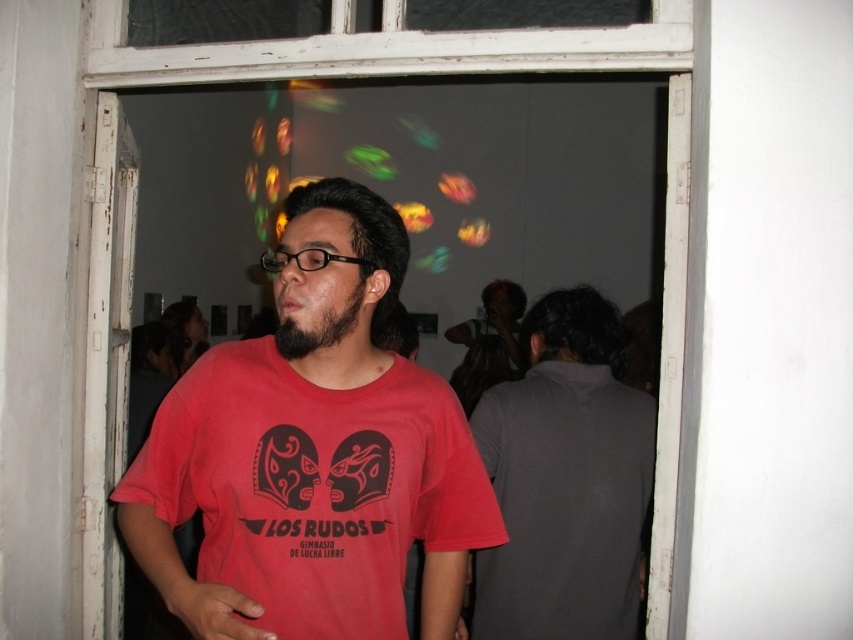
Between matte red t-shirt at center and dark gray shirt at right, which one has less height?

With less height is matte red t-shirt at center.

Is matte red t-shirt at center smaller than dark gray shirt at right?

Incorrect, matte red t-shirt at center is not smaller in size than dark gray shirt at right.

Where is `matte red t-shirt at center`? The width and height of the screenshot is (853, 640). matte red t-shirt at center is located at coordinates (312, 456).

Between point (155, 515) and point (296, 339), which one is positioned behind?

The point (155, 515) is behind.

Looking at this image, which is more to the left, matte red t-shirt at center or black fuzzy beard at center?

From the viewer's perspective, black fuzzy beard at center appears more on the left side.

Locate an element on the screen. Image resolution: width=853 pixels, height=640 pixels. matte red t-shirt at center is located at coordinates (312, 456).

Which of these two, transparent glass window at upper center or black fuzzy beard at center, stands shorter?

black fuzzy beard at center is shorter.

Describe the element at coordinates (473, 72) in the screenshot. I see `transparent glass window at upper center` at that location.

Between point (103, 74) and point (294, 353), which one is positioned behind?

Point (103, 74)

The image size is (853, 640). What are the coordinates of `transparent glass window at upper center` in the screenshot? It's located at (473, 72).